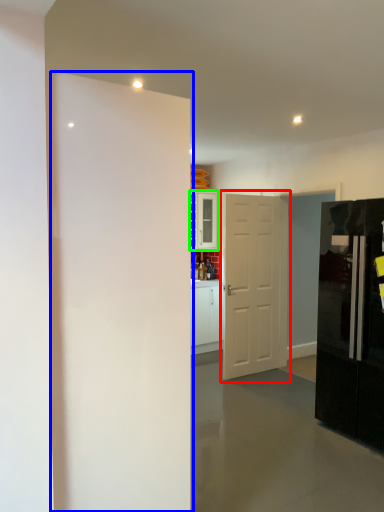
Question: Which is nearer to the door (highlighted by a red box)? door (highlighted by a blue box) or cabinetry (highlighted by a green box).

Choices:
 (A) door
 (B) cabinetry

Answer: (B)